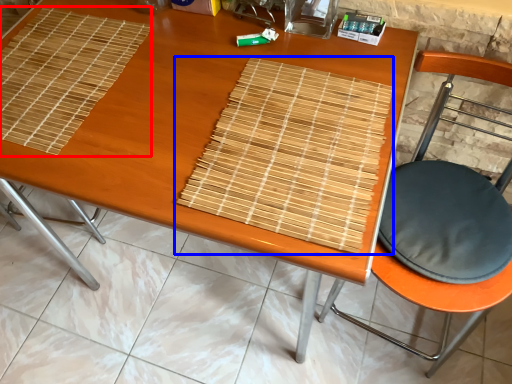
Question: Among these objects, which one is nearest to the camera, mat (highlighted by a red box) or mat (highlighted by a blue box)?

Choices:
 (A) mat
 (B) mat

Answer: (B)